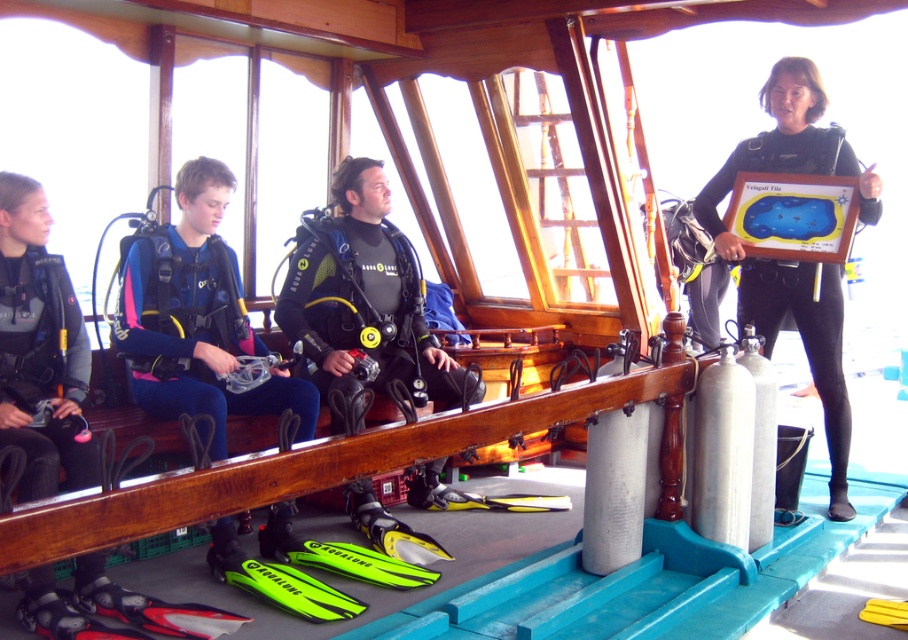
Based on the photo, you are a diver who just entered the boat cabin and need to grab your wetsuit. You see the pink neoprene wetsuit at left and the black matte wetsuit at right. Which one is easier to reach without moving from your current position?

The pink neoprene wetsuit at left is closer to the viewer, so it is easier to reach without moving from your current position.

You are navigating a drone over a boat cabin. The drone needs to hover at a specific coordinate to capture a photo of the matte black wetsuit at left. What are the exact coordinates where the drone should hover?

The drone should hover at coordinates point (40, 348) to capture the matte black wetsuit at left.

You are a scuba diver who needs to retrieve your wetsuit from the cabin. You see the matte black wetsuit at left and the black matte wetsuit at right. Which one is positioned lower?

The matte black wetsuit at left is positioned lower because it is below the black matte wetsuit at right.